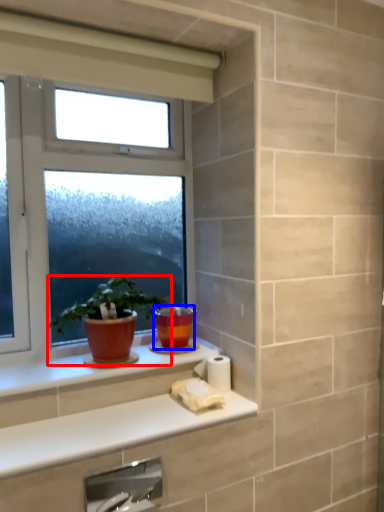
Question: Which point is closer to the camera, houseplant (highlighted by a red box) or flowerpot (highlighted by a blue box)?

Choices:
 (A) houseplant
 (B) flowerpot

Answer: (A)